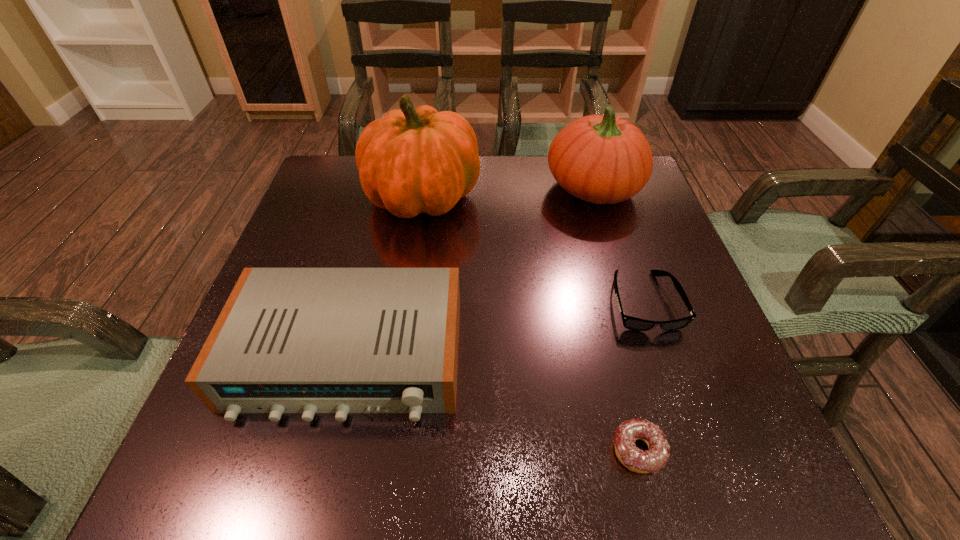
I want to click on free space that is in between the radio receiver and the doughnut, so click(x=492, y=403).

Image resolution: width=960 pixels, height=540 pixels. Find the location of `free space between the shortest object and the tallest object`. free space between the shortest object and the tallest object is located at coordinates (530, 323).

In order to click on free space between the radio receiver and the shorter pumpkin in this screenshot , I will do `click(470, 272)`.

The width and height of the screenshot is (960, 540). In order to click on free space between the third tallest object and the shortest object in this screenshot , I will do `click(492, 403)`.

The image size is (960, 540). In order to click on vacant area that lies between the taller pumpkin and the shortest object in this screenshot , I will do `click(530, 323)`.

Where is `the second closest object relative to the shortest object`? This screenshot has height=540, width=960. the second closest object relative to the shortest object is located at coordinates (288, 340).

Identify the location of object that is the second closest one to the left pumpkin. (288, 340).

This screenshot has width=960, height=540. Identify the location of free spot that satisfies the following two spatial constraints: 1. on the control panel of the radio receiver; 2. on the right side of the shortest object. (324, 450).

I want to click on vacant space that satisfies the following two spatial constraints: 1. on the back side of the doughnut; 2. on the left side of the shorter pumpkin, so click(572, 188).